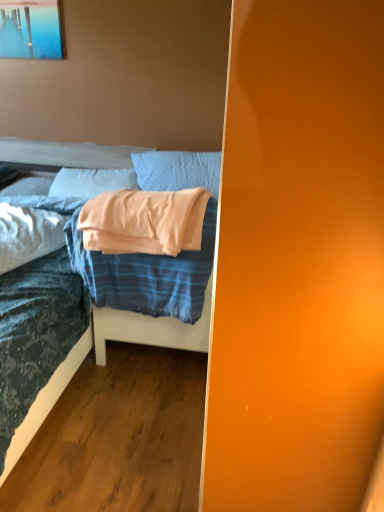
The height and width of the screenshot is (512, 384). What are the coordinates of `empty space that is ontop of blue plaid bed at lower left (from a real-world perspective)` in the screenshot? It's located at (131, 408).